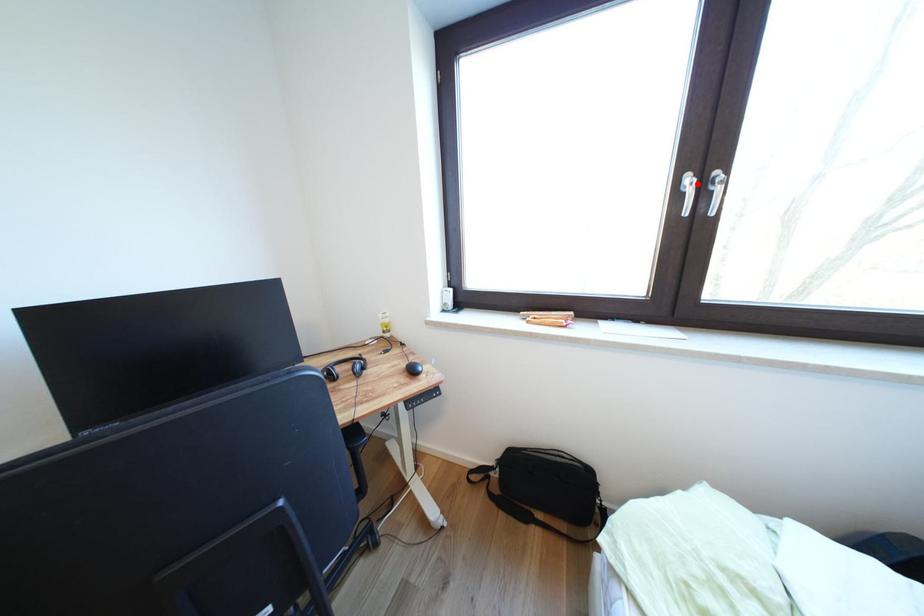
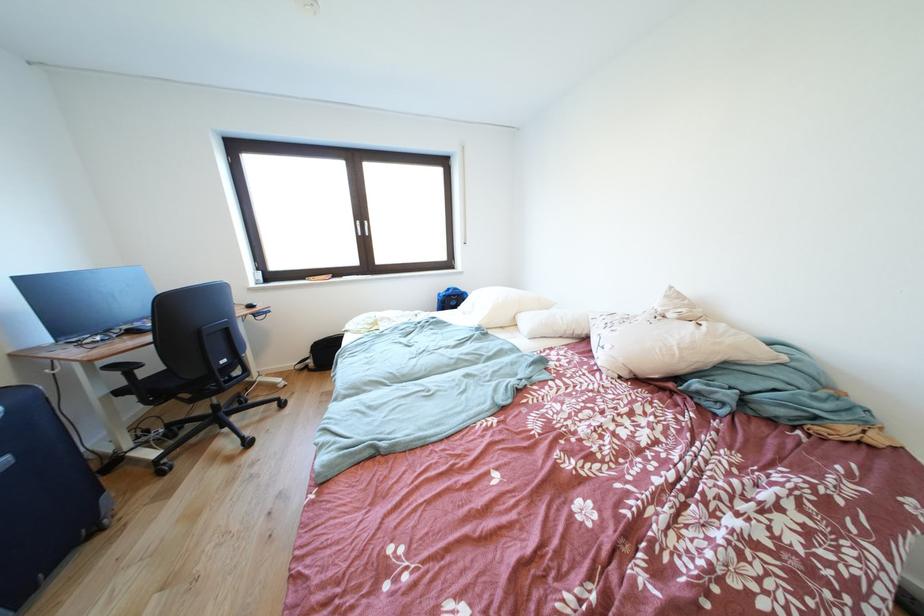
Find the pixel in the second image that matches the highlighted location in the first image.

(367, 228)